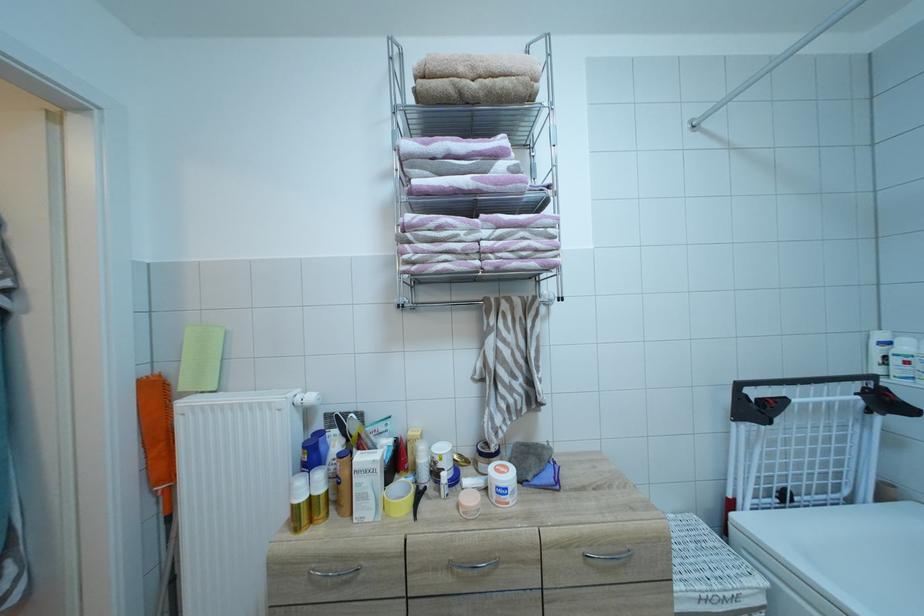
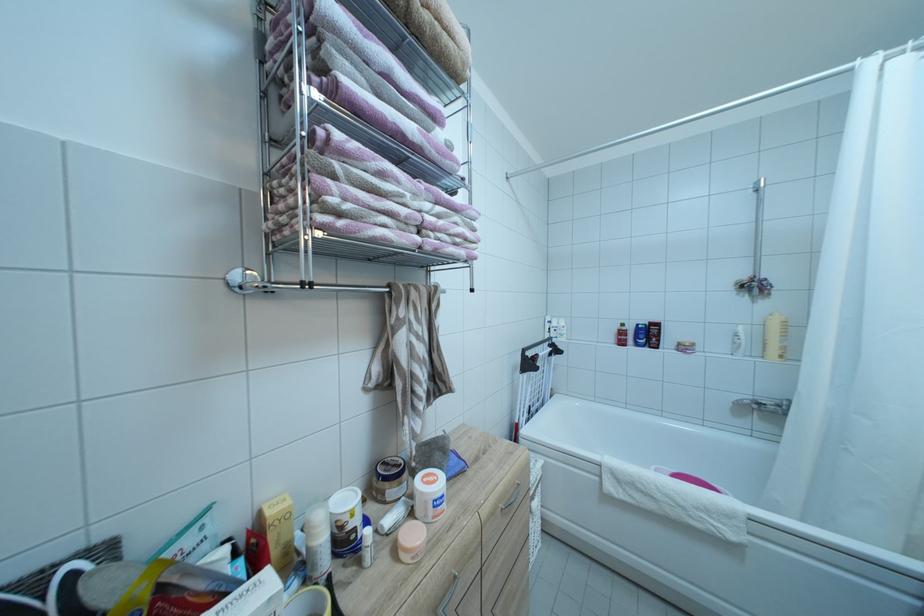
The point at (500,245) is marked in the first image. Where is the corresponding point in the second image?

(440, 221)